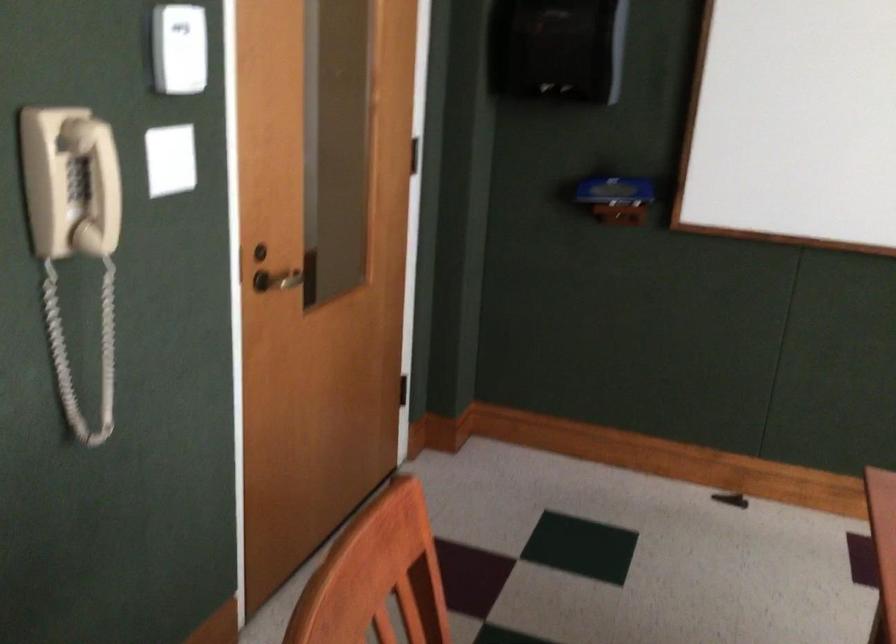
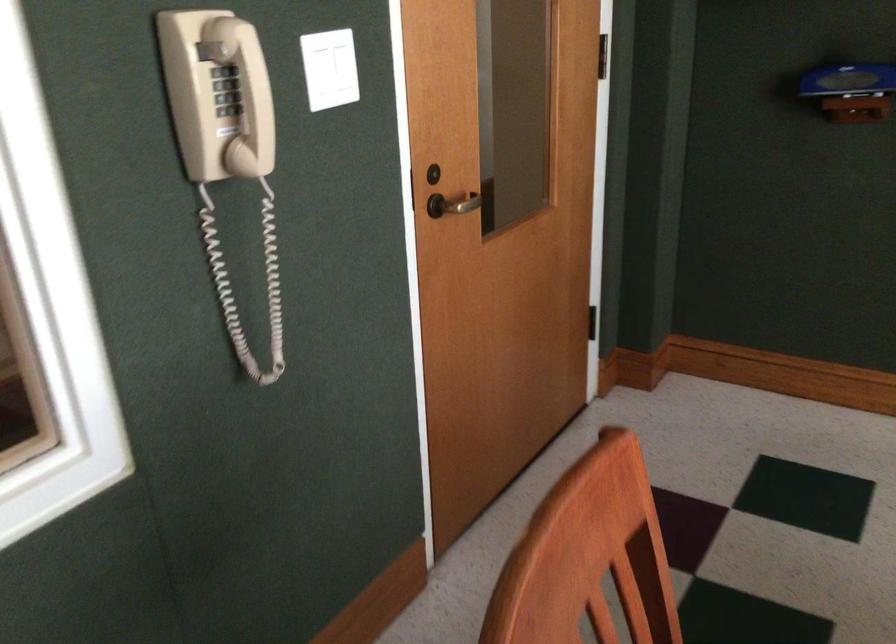
The point at [243,275] is marked in the first image. Where is the corresponding point in the second image?

(409, 191)